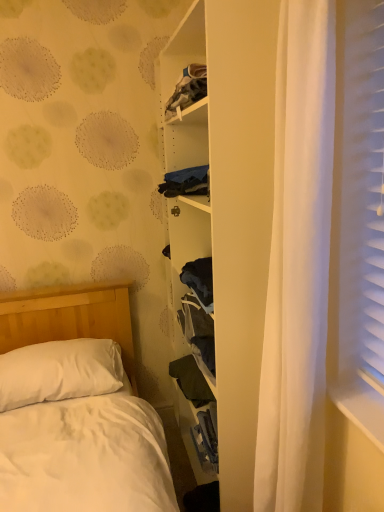
Image resolution: width=384 pixels, height=512 pixels. What do you see at coordinates (191, 381) in the screenshot?
I see `dark green fabric at center` at bounding box center [191, 381].

What do you see at coordinates (228, 204) in the screenshot? The image size is (384, 512). I see `white matte bookshelf at center` at bounding box center [228, 204].

Find the location of a particular element. dark green fabric at center is located at coordinates (191, 381).

In the scene shown: Considering the sizes of dark green fabric at center and white matte bookshelf at center in the image, is dark green fabric at center bigger or smaller than white matte bookshelf at center?

In the image, dark green fabric at center appears to be smaller than white matte bookshelf at center.

From the image's perspective, is dark green fabric at center above white matte bookshelf at center?

Actually, dark green fabric at center appears below white matte bookshelf at center in the image.

Find the location of a particular element. The image size is (384, 512). bookshelf that is on the right side of dark green fabric at center is located at coordinates (228, 204).

From the image's perspective, which one is positioned lower, white soft pillow at lower left or white matte bookshelf at center?

white soft pillow at lower left appears lower in the image.

Which of these two, white soft pillow at lower left or white matte bookshelf at center, is thinner?

With smaller width is white matte bookshelf at center.

Is white soft pillow at lower left taller than white matte bookshelf at center?

No.

Looking at this image, is white soft pillow at lower left closer to camera compared to white matte bookshelf at center?

No, white soft pillow at lower left is behind white matte bookshelf at center.

Do you think dark green fabric at center is within white soft pillow at lower left, or outside of it?

dark green fabric at center exists outside the volume of white soft pillow at lower left.

Is dark green fabric at center oriented away from white soft pillow at lower left?

No, dark green fabric at center's orientation is not away from white soft pillow at lower left.

From a real-world perspective, who is located lower, dark green fabric at center or white soft pillow at lower left?

dark green fabric at center.

Find the location of a particular element. This screenshot has height=512, width=384. pillow lying in front of the dark green fabric at center is located at coordinates (59, 371).

Looking at their sizes, would you say white soft pillow at lower left is wider or thinner than dark green fabric at center?

In the image, white soft pillow at lower left appears to be wider than dark green fabric at center.

Are white soft pillow at lower left and dark green fabric at center making contact?

No, white soft pillow at lower left is not touching dark green fabric at center.

From the image's perspective, is white soft pillow at lower left above or below dark green fabric at center?

Clearly, from the image's perspective, white soft pillow at lower left is above dark green fabric at center.

Between point (105, 370) and point (189, 359), which one is positioned behind?

The point (189, 359) is more distant.

From a real-world perspective, is white matte bookshelf at center physically located above or below white soft pillow at lower left?

From a real-world perspective, white matte bookshelf at center is physically above white soft pillow at lower left.

Can you confirm if white matte bookshelf at center is positioned to the right of white soft pillow at lower left?

Yes, white matte bookshelf at center is to the right of white soft pillow at lower left.

Does white matte bookshelf at center have a smaller size compared to white soft pillow at lower left?

No, white matte bookshelf at center is not smaller than white soft pillow at lower left.

Would you say white soft pillow at lower left is part of white matte bookshelf at center's contents?

Definitely not — white soft pillow at lower left is not inside white matte bookshelf at center.

Does white matte bookshelf at center have a greater height compared to dark green fabric at center?

Yes, white matte bookshelf at center is taller than dark green fabric at center.

Is point (222, 276) closer or farther from the camera than point (180, 362)?

Point (222, 276) is positioned closer to the camera compared to point (180, 362).

Consider the image. Is white matte bookshelf at center not inside dark green fabric at center?

white matte bookshelf at center lies outside dark green fabric at center's area.

Could you tell me if white matte bookshelf at center is turned towards dark green fabric at center?

Yes, white matte bookshelf at center is turned towards dark green fabric at center.

This screenshot has height=512, width=384. What are the coordinates of `bookshelf on the right of dark green fabric at center` in the screenshot? It's located at (228, 204).

Where is `bookshelf in front of the white soft pillow at lower left`? The height and width of the screenshot is (512, 384). bookshelf in front of the white soft pillow at lower left is located at coordinates (228, 204).

From the image, which object appears to be nearer to dark green fabric at center, white soft pillow at lower left or white matte bookshelf at center?

white soft pillow at lower left lies closer to dark green fabric at center than the other object.

From the picture: From the image, which object appears to be nearer to white matte bookshelf at center, dark green fabric at center or white soft pillow at lower left?

dark green fabric at center lies closer to white matte bookshelf at center than the other object.

Looking at this image, which object lies further to the anchor point white soft pillow at lower left, dark green fabric at center or white matte bookshelf at center?

A: white matte bookshelf at center is positioned further to the anchor white soft pillow at lower left.

When comparing their distances from white matte bookshelf at center, does white soft pillow at lower left or dark green fabric at center seem further?

Based on the image, white soft pillow at lower left appears to be further to white matte bookshelf at center.

Based on their spatial positions, is white matte bookshelf at center or white soft pillow at lower left closer to dark green fabric at center?

The object closer to dark green fabric at center is white soft pillow at lower left.

Looking at the image, which one is located closer to white soft pillow at lower left, white matte bookshelf at center or dark green fabric at center?

dark green fabric at center is closer to white soft pillow at lower left.

Where is `clothing located between white soft pillow at lower left and white matte bookshelf at center in the left-right direction`? The width and height of the screenshot is (384, 512). clothing located between white soft pillow at lower left and white matte bookshelf at center in the left-right direction is located at coordinates (191, 381).